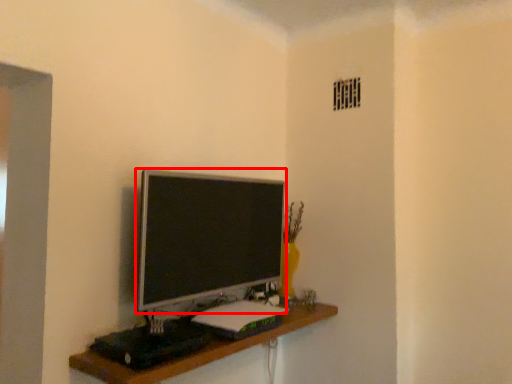
Question: From the image's perspective, where is television (annotated by the red box) located relative to shelf?

Choices:
 (A) above
 (B) below

Answer: (A)